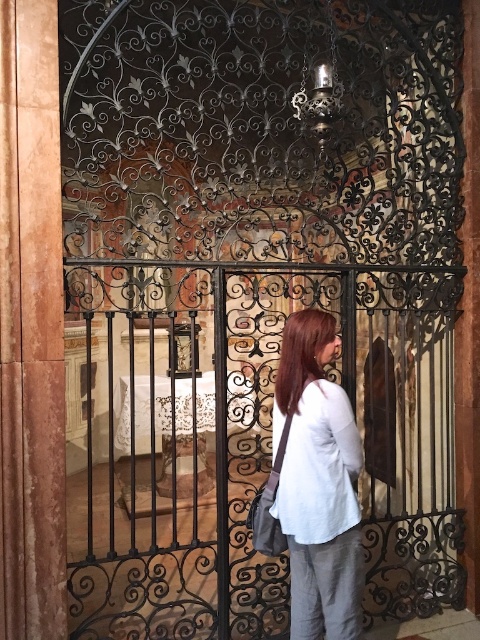
Does white linen shirt at center appear on the left side of shiny brown hair at center?

In fact, white linen shirt at center is to the right of shiny brown hair at center.

Does white linen shirt at center have a smaller size compared to shiny brown hair at center?

No, white linen shirt at center is not smaller than shiny brown hair at center.

At what (x,y) coordinates should I click in order to perform the action: click on white linen shirt at center. Please return your answer as a coordinate pair (x, y). The width and height of the screenshot is (480, 640). Looking at the image, I should click on (320, 467).

Is point (346, 518) positioned in front of point (294, 353)?

Yes, it is in front of point (294, 353).

Describe the element at coordinates (317, 483) in the screenshot. The height and width of the screenshot is (640, 480). I see `light gray cotton shirt at center` at that location.

This screenshot has width=480, height=640. Find the location of `light gray cotton shirt at center`. light gray cotton shirt at center is located at coordinates coord(317,483).

Which of these two, light gray cotton shirt at center or white linen shirt at center, stands taller?

With more height is light gray cotton shirt at center.

This screenshot has width=480, height=640. I want to click on light gray cotton shirt at center, so click(x=317, y=483).

Locate an element on the screen. light gray cotton shirt at center is located at coordinates (317, 483).

At what (x,y) coordinates should I click in order to perform the action: click on light gray cotton shirt at center. Please return your answer as a coordinate pair (x, y). Looking at the image, I should click on (317, 483).